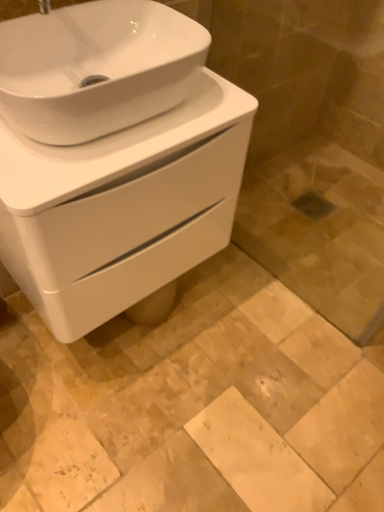
Question: Does beige marble tile at center have a smaller size compared to white glossy sink at center?

Choices:
 (A) yes
 (B) no

Answer: (A)

Question: From the image's perspective, does beige marble tile at center appear lower than white glossy sink at center?

Choices:
 (A) no
 (B) yes

Answer: (B)

Question: Does beige marble tile at center lie in front of white glossy sink at center?

Choices:
 (A) no
 (B) yes

Answer: (A)

Question: Can you confirm if beige marble tile at center is thinner than white glossy sink at center?

Choices:
 (A) no
 (B) yes

Answer: (A)

Question: Is beige marble tile at center positioned far away from white glossy sink at center?

Choices:
 (A) no
 (B) yes

Answer: (A)

Question: Is white glossy sink at upper left wider or thinner than transparent glass door at lower right?

Choices:
 (A) wide
 (B) thin

Answer: (A)

Question: Is white glossy sink at upper left inside the boundaries of transparent glass door at lower right, or outside?

Choices:
 (A) outside
 (B) inside

Answer: (A)

Question: Is point (89, 138) positioned closer to the camera than point (291, 281)?

Choices:
 (A) closer
 (B) farther

Answer: (A)

Question: From a real-world perspective, is white glossy sink at upper left positioned above or below transparent glass door at lower right?

Choices:
 (A) below
 (B) above

Answer: (B)

Question: From the image's perspective, is transparent glass door at lower right located above or below white glossy sink at center?

Choices:
 (A) below
 (B) above

Answer: (B)

Question: Is transparent glass door at lower right bigger or smaller than white glossy sink at center?

Choices:
 (A) big
 (B) small

Answer: (B)

Question: Visually, is transparent glass door at lower right positioned to the left or to the right of white glossy sink at center?

Choices:
 (A) left
 (B) right

Answer: (B)

Question: Would you say transparent glass door at lower right is inside or outside white glossy sink at center?

Choices:
 (A) outside
 (B) inside

Answer: (A)

Question: Is point (100, 310) closer or farther from the camera than point (223, 421)?

Choices:
 (A) farther
 (B) closer

Answer: (B)

Question: From a real-world perspective, is white glossy sink at center physically located above or below beige marble tile at center?

Choices:
 (A) above
 (B) below

Answer: (A)